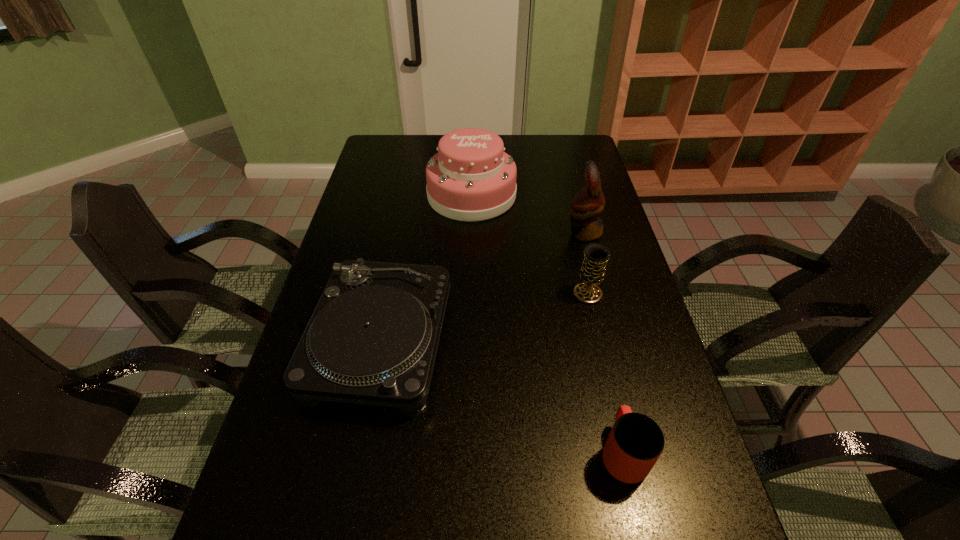
The height and width of the screenshot is (540, 960). What are the coordinates of `parrot` in the screenshot? It's located at (589, 202).

In order to click on the fourth shortest object in this screenshot , I will do `click(471, 178)`.

You are a GUI agent. You are given a task and a screenshot of the screen. Output one action in this format:
    pyautogui.click(x=<x>, y=<y>)
    Task: Click on the cake
    The height and width of the screenshot is (540, 960).
    Given the screenshot: What is the action you would take?
    pyautogui.click(x=471, y=178)

The width and height of the screenshot is (960, 540). Find the location of `chalice`. chalice is located at coordinates (596, 255).

Locate an element on the screen. This screenshot has width=960, height=540. record player is located at coordinates (372, 339).

At what (x,y) coordinates should I click in order to perform the action: click on the nearest object. Please return your answer as a coordinate pair (x, y). The height and width of the screenshot is (540, 960). Looking at the image, I should click on (635, 443).

I want to click on free region located on the face of the parrot, so click(505, 232).

Identify the location of vacant space located 0.110m on the face of the parrot. The width and height of the screenshot is (960, 540). (533, 232).

Where is `free space located 0.100m on the face of the parrot`? This screenshot has height=540, width=960. free space located 0.100m on the face of the parrot is located at coordinates (536, 232).

Find the location of a particular element. The width and height of the screenshot is (960, 540). vacant position located on the left of the fourth shortest object is located at coordinates (411, 195).